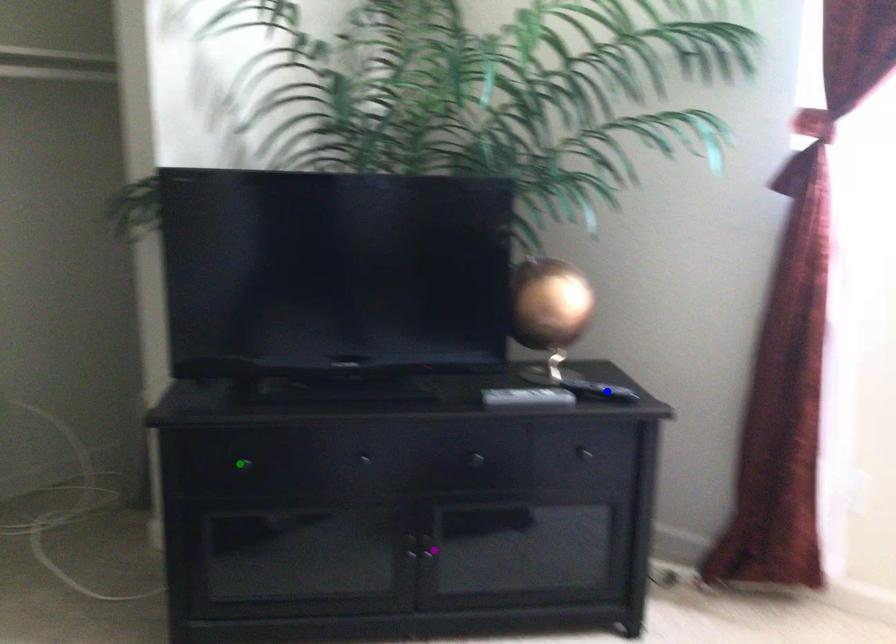
Order these from nearest to farthest:
blue point, green point, purple point

green point → purple point → blue point